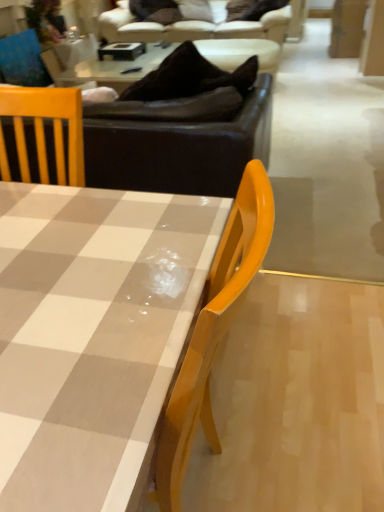
Question: Would you say checkered fabric coffee table at center is to the left or to the right of brown leather couch at upper center, marked as the second studio couch in a top-to-bottom arrangement, in the picture?

Choices:
 (A) right
 (B) left

Answer: (A)

Question: Is point (54, 218) positioned closer to the camera than point (96, 184)?

Choices:
 (A) farther
 (B) closer

Answer: (B)

Question: Based on their relative distances, which object is nearer to the matte blue cushion at upper left?

Choices:
 (A) checkered fabric coffee table at center
 (B) brown leather couch at upper center, arranged as the second studio couch when ordered from the bottom
 (C) brown leather couch at upper center, the 1th studio couch from the front
 (D) matte brown plywood at upper right

Answer: (B)

Question: Which of these objects is positioned farthest from the checkered fabric coffee table at center?

Choices:
 (A) matte blue cushion at upper left
 (B) matte brown plywood at upper right
 (C) brown leather couch at upper center, which is the 1th studio couch in top-to-bottom order
 (D) brown leather couch at upper center, the first studio couch from the bottom

Answer: (B)